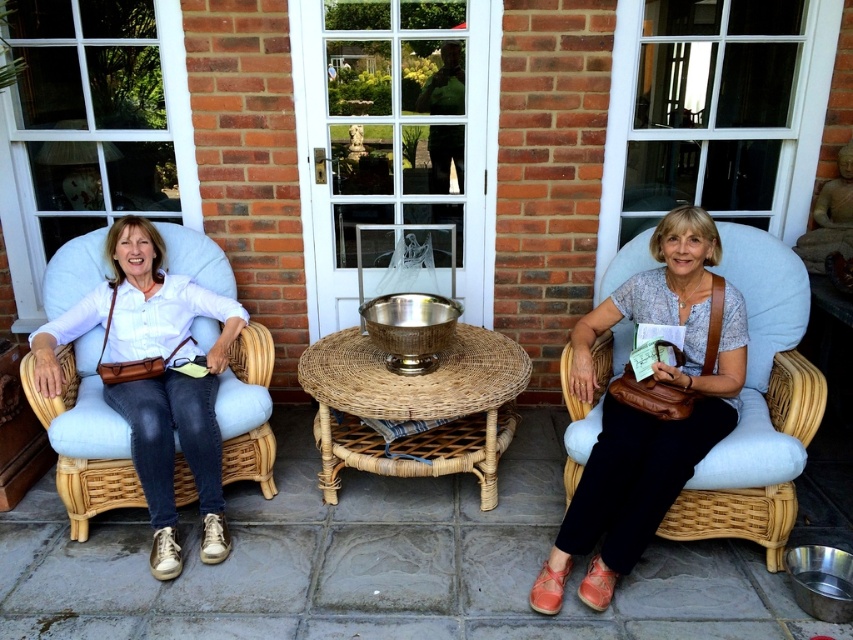
You are designing a layout for a photo shoot and need to ensure that the matte leather armchair at right does not block the view of the matte white blouse at left. Based on their heights, which object should be placed closer to the camera?

The matte leather armchair at right is shorter than the matte white blouse at left. To ensure the blouse is visible, place the matte leather armchair at right closer to the camera so it doesn

You are designing a layout for a small waiting area and need to place both the matte leather armchair at right and the matte white blouse at left. Given their sizes, which object should be placed closer to the entrance to ensure there is enough space for people to move around?

The matte leather armchair at right is larger in size than the matte white blouse at left, so it should be placed closer to the entrance to allow more space for movement around the smaller matte white blouse at left.

You are standing at the origin of the coordinate system in the image. You want to walk to the point at (463, 465) but need to pass through the point at (784, 326) first. Is this possible?

Point (784, 326) is behind point (463, 465), so you cannot reach point (784, 326) first before reaching point (463, 465).